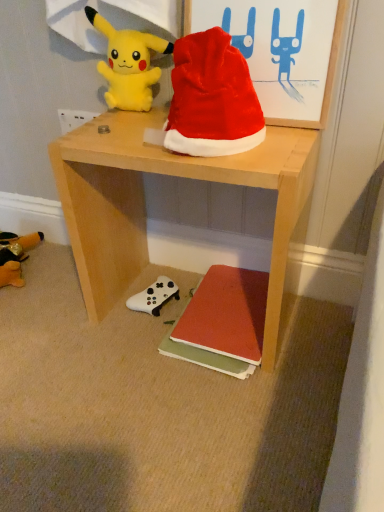
The height and width of the screenshot is (512, 384). Identify the location of free space to the left of red velvet santa hat at upper center. (123, 134).